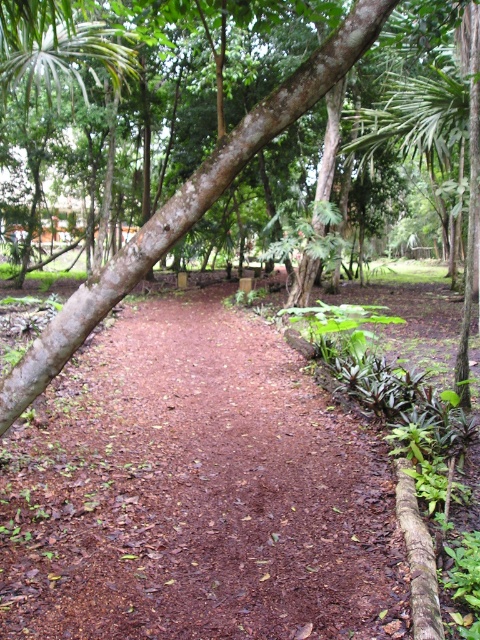
Does brown dirt trail at center have a larger size compared to brown rough tree at center?

Yes.

Who is positioned more to the right, brown dirt trail at center or brown rough tree at center?

brown rough tree at center is more to the right.

What are the coordinates of `brown dirt trail at center` in the screenshot? It's located at (195, 492).